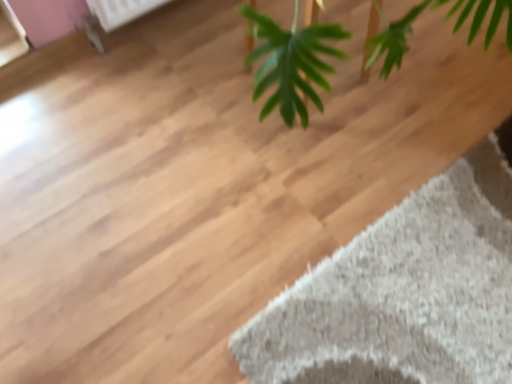
Locate an element on the screen. The image size is (512, 384). vacant space behind white shaggy rug at lower right is located at coordinates (389, 129).